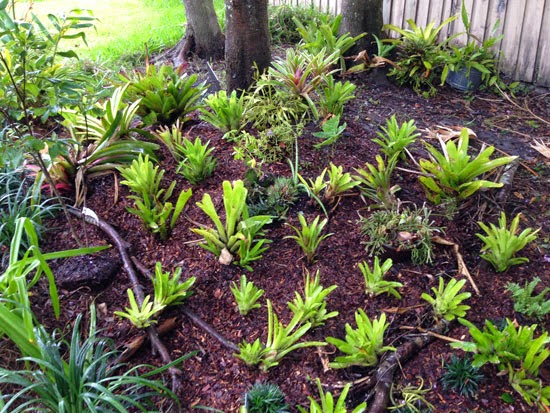
Identify the location of planter plastic. The height and width of the screenshot is (413, 550). (472, 75).